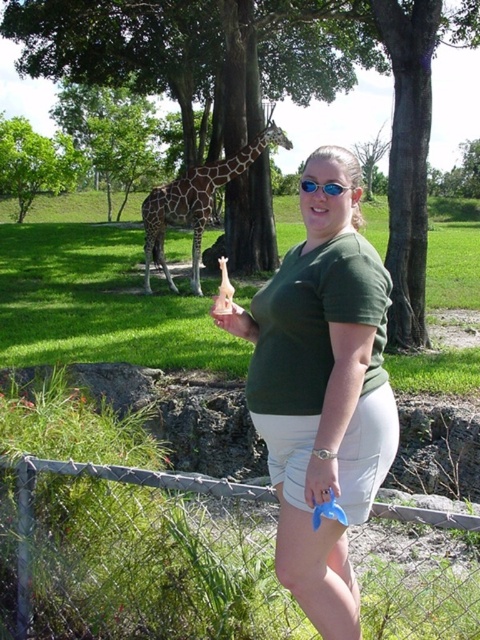
Question: Among these objects, which one is farthest from the camera?

Choices:
 (A) spotted fur giraffe at center
 (B) metal chain-link fence at lower center

Answer: (A)

Question: From the image, what is the correct spatial relationship of green matte shirt at center in relation to pink matte handbag at center?

Choices:
 (A) below
 (B) above

Answer: (A)

Question: Can you confirm if metal chain-link fence at lower center is wider than green matte shirt at center?

Choices:
 (A) yes
 (B) no

Answer: (A)

Question: Does metal chain-link fence at lower center appear under pink matte handbag at center?

Choices:
 (A) no
 (B) yes

Answer: (B)

Question: Which point appears closest to the camera in this image?

Choices:
 (A) (152, 218)
 (B) (236, 320)

Answer: (B)

Question: Which point is closer to the camera?

Choices:
 (A) (231, 312)
 (B) (213, 163)
 (C) (432, 545)
 (D) (387, 464)

Answer: (D)